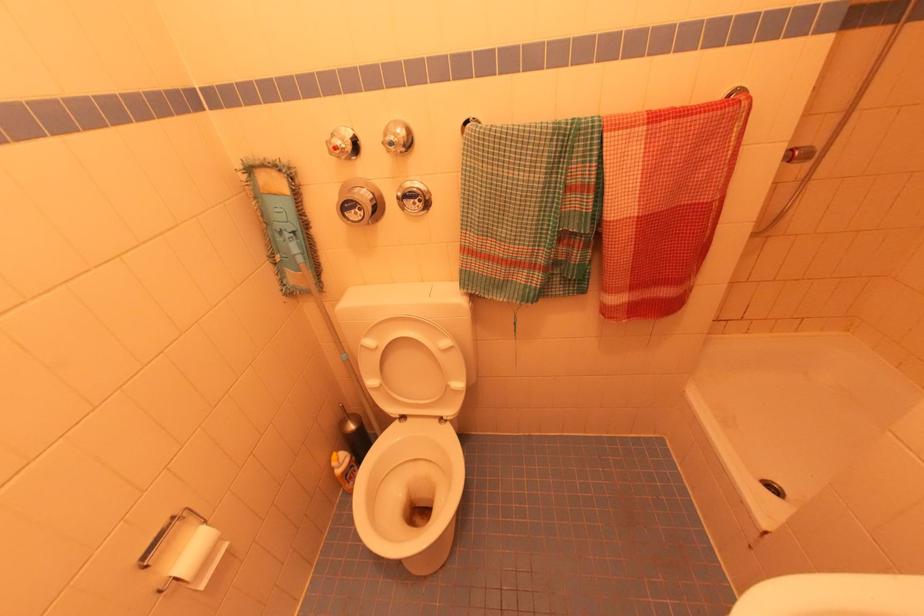
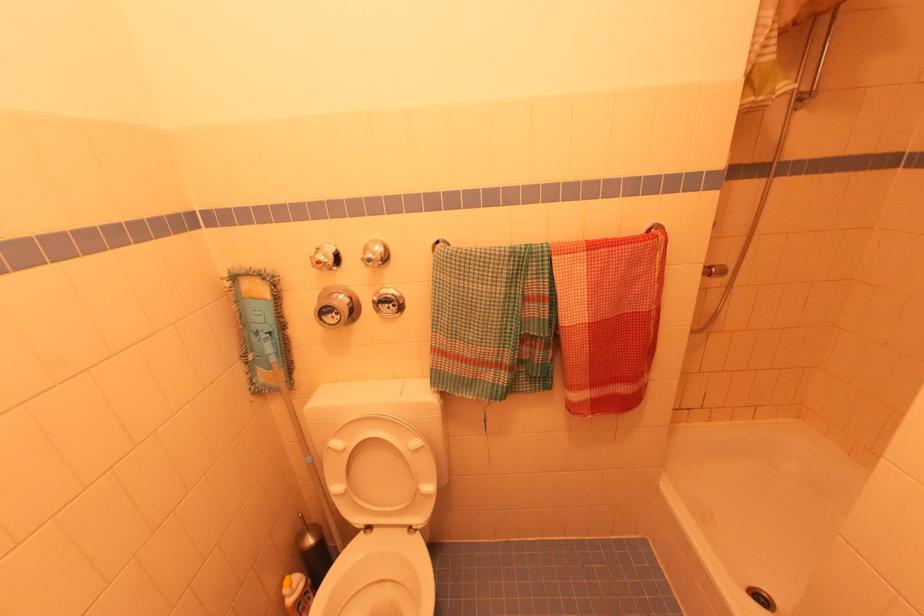
Where in the second image is the point corresponding to point 471,132 from the first image?

(441, 253)